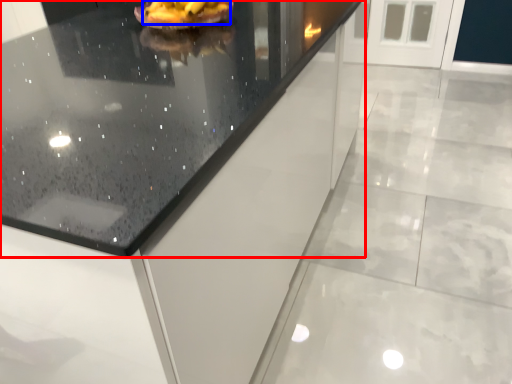
Question: Which point is further to the camera, countertop (highlighted by a red box) or food (highlighted by a blue box)?

Choices:
 (A) countertop
 (B) food

Answer: (B)